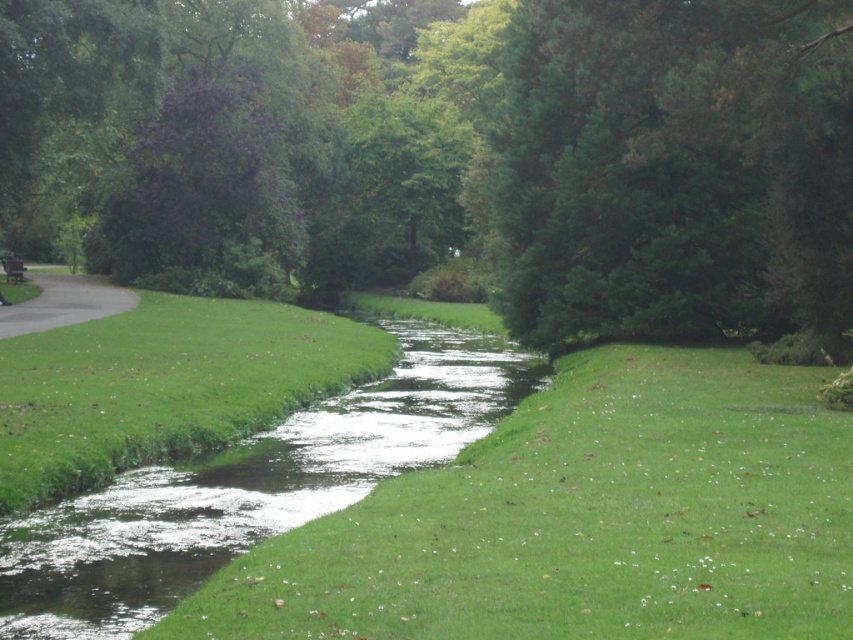
Question: Estimate the real-world distances between objects in this image. Which object is closer to the green leafy tree at upper center?

Choices:
 (A) wooden park bench at left
 (B) gray asphalt path at left

Answer: (B)

Question: Does green leafy tree at upper center appear on the right side of gray asphalt path at left?

Choices:
 (A) yes
 (B) no

Answer: (A)

Question: Which point appears closest to the camera in this image?

Choices:
 (A) click(x=15, y=273)
 (B) click(x=422, y=381)

Answer: (B)

Question: Can you confirm if green grassy at center is bigger than gray asphalt path at left?

Choices:
 (A) no
 (B) yes

Answer: (A)

Question: Which of these objects is positioned closest to the wooden park bench at left?

Choices:
 (A) gray asphalt path at left
 (B) green leafy tree at upper center
 (C) clear water stream at center

Answer: (A)

Question: Is green leafy tree at upper center to the right of clear water stream at center from the viewer's perspective?

Choices:
 (A) no
 (B) yes

Answer: (A)